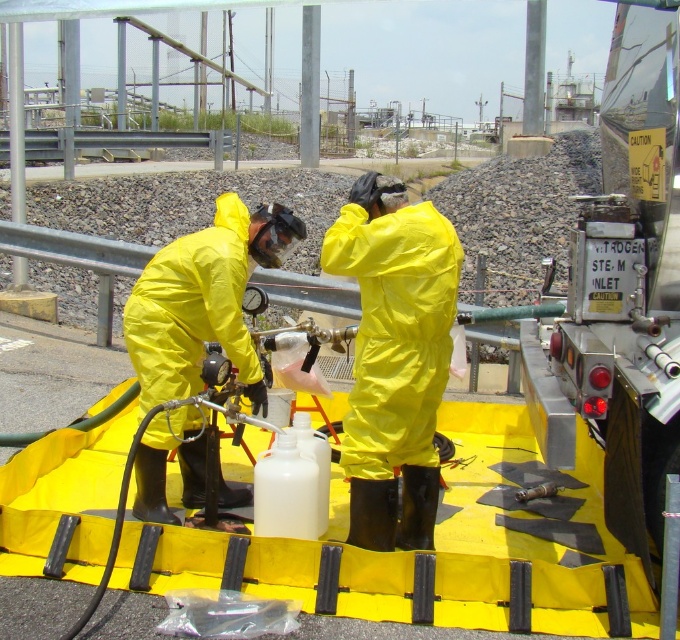
You are a safety inspector in the industrial area. You observe two workers in hazmat suits. One is wearing a yellow matte suit at center and the other a matte yellow hazmat suit at center. Which worker is standing to the right of the other?

The yellow matte suit at center is positioned on the right side of the matte yellow hazmat suit at center, so the worker in the yellow matte suit at center is to the right of the other worker in the matte yellow hazmat suit at center.

You are a safety inspector in the industrial area. You need to ensure that the two workers in yellow matte suit at center and matte yellow hazmat suit at center are maintaining a safe distance of at least 30 inches apart for safety protocols. Based on the image, are they compliant with the safety distance requirement?

The yellow matte suit at center is 27.40 inches away from the matte yellow hazmat suit at center. Since 27.40 inches is less than the required 30 inches, the workers are not compliant with the safety distance requirement.